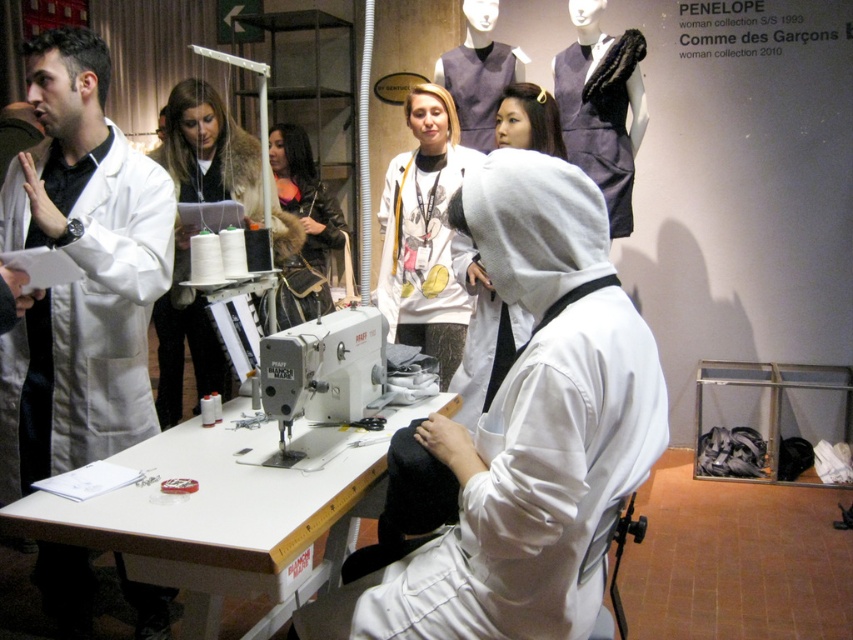
You are organizing a sewing workshop and need to place the metallic gray sewing machine at center and the matte gray dress at upper center on a narrow shelf. Which object should you place first to ensure both fit side by side?

The metallic gray sewing machine at center is thinner than the matte gray dress at upper center, so you should place the wider matte gray dress at upper center first to ensure both fit side by side on the narrow shelf.

You are a tailor who needs to move a 1.2 meter wide table through the space between the white matte sweatshirt at center and the leather jacket at center. Based on the scene description, will the table fit through that space?

The distance between the white matte sweatshirt at center and the leather jacket at center is 1.16 meters. Since the table is 1.2 meters wide, it will not fit through the space as it is slightly wider than the available gap.

You are standing at the entrance of the workshop and want to locate the metallic gray sewing machine at center. According to the coordinates provided, where should you look to find it?

The metallic gray sewing machine at center is located at coordinates point (318,381).